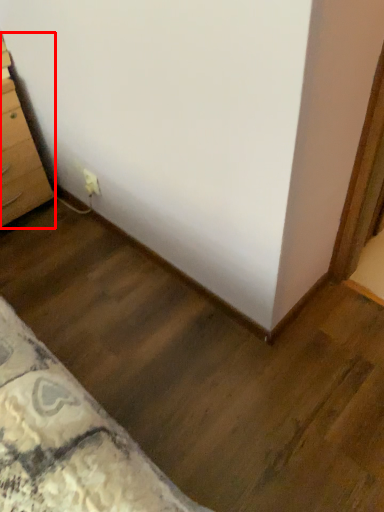
Question: From the image's perspective, what is the correct spatial positioning of chest of drawers (annotated by the red box) in reference to electric outlet?

Choices:
 (A) above
 (B) below

Answer: (A)